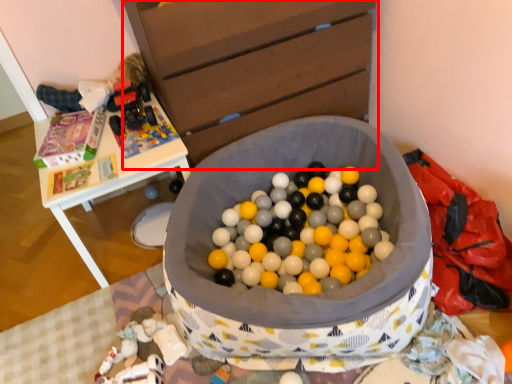
Question: From the image's perspective, where is chest of drawers (annotated by the red box) located relative to table?

Choices:
 (A) above
 (B) below

Answer: (A)